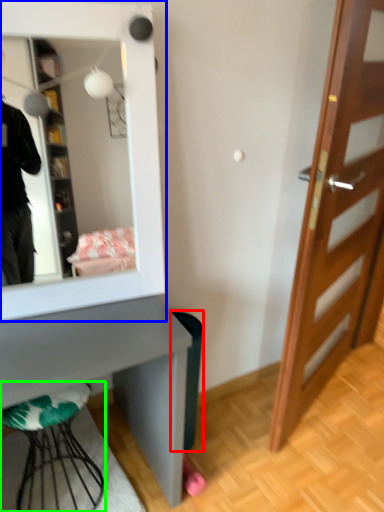
Question: Which object is positioned closest to trash bin/can (highlighted by a red box)? Select from mirror (highlighted by a blue box) and furniture (highlighted by a green box).

Choices:
 (A) mirror
 (B) furniture

Answer: (B)